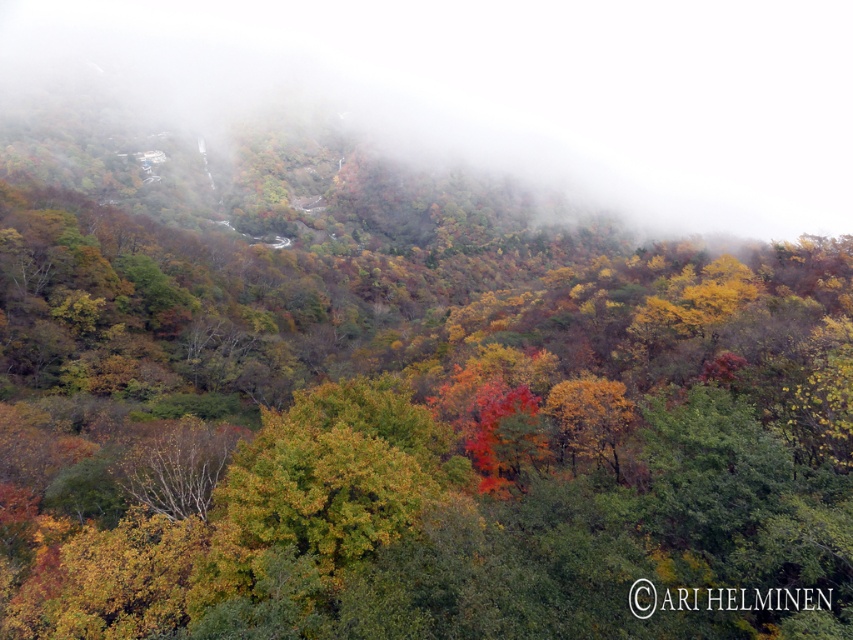
Question: Does foggy translucent mist at upper left appear over golden yellow leaves at center?

Choices:
 (A) yes
 (B) no

Answer: (A)

Question: Can you confirm if foggy translucent mist at upper left is positioned above golden yellow leaves at center?

Choices:
 (A) no
 (B) yes

Answer: (B)

Question: Which point is farther to the camera?

Choices:
 (A) foggy translucent mist at upper left
 (B) golden yellow leaves at center

Answer: (A)

Question: Which point is farther to the camera?

Choices:
 (A) golden yellow leaves at center
 (B) foggy translucent mist at upper left

Answer: (B)

Question: Is foggy translucent mist at upper left positioned at the back of golden yellow leaves at center?

Choices:
 (A) yes
 (B) no

Answer: (A)